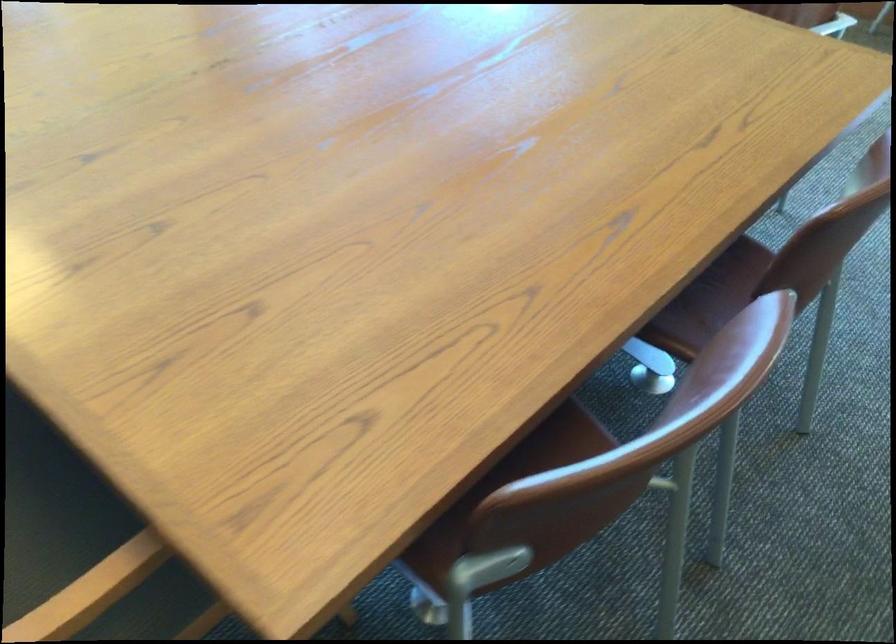
This screenshot has height=644, width=896. I want to click on brown chair armrest, so click(x=650, y=366).